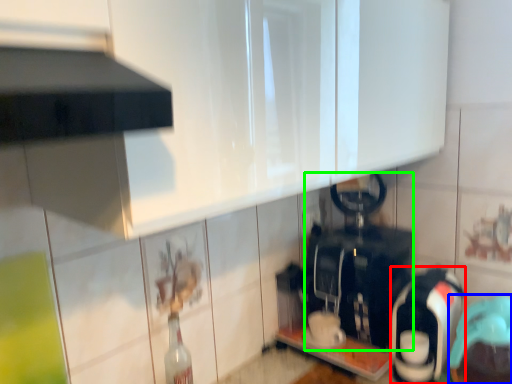
Question: Based on their relative distances, which object is nearer to appliance (highlighted by a red box)? Choose from appliance (highlighted by a blue box) and appliance (highlighted by a green box).

Choices:
 (A) appliance
 (B) appliance

Answer: (A)